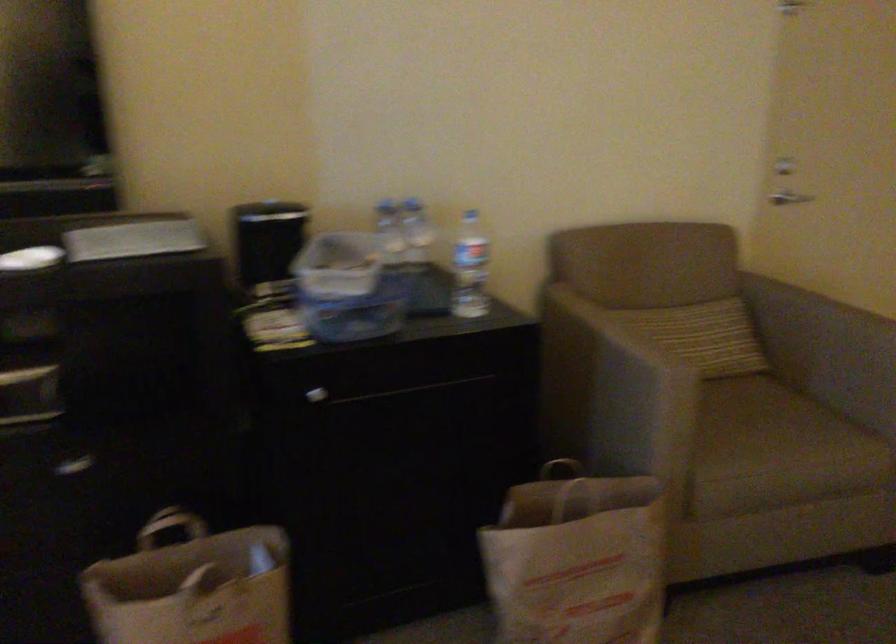
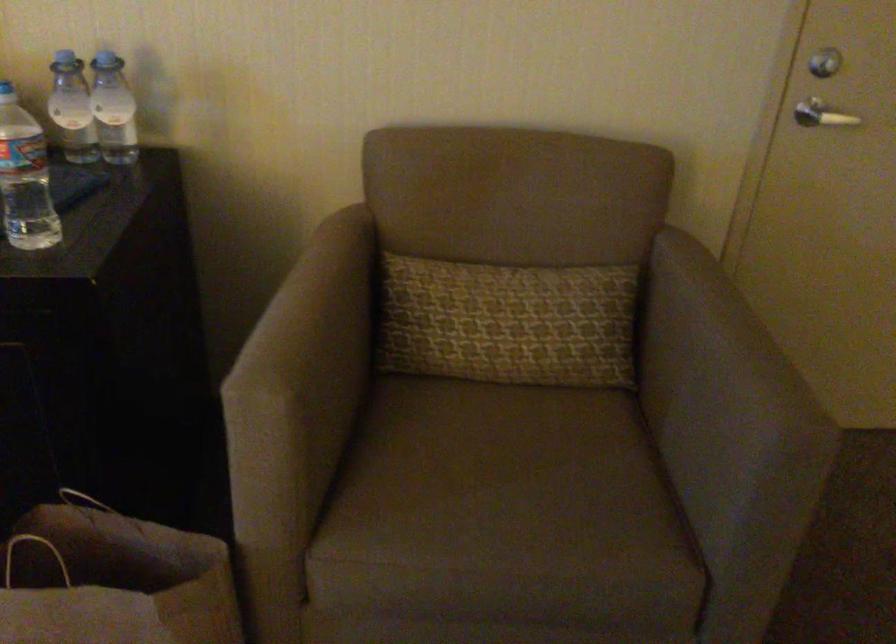
The images are taken continuously from a first-person perspective. In which direction are you moving?

The cameraman moved toward right, forward.